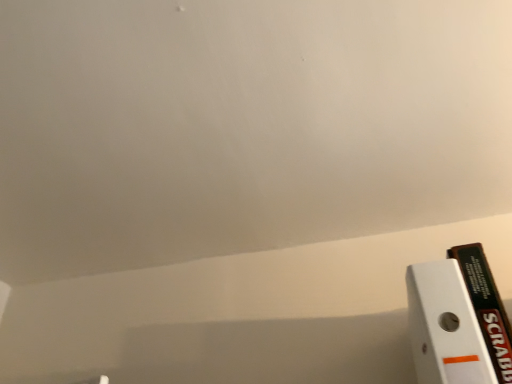
Question: From the image's perspective, is black cardboard book at right positioned above or below white matte paper at lower right?

Choices:
 (A) below
 (B) above

Answer: (A)

Question: Is black cardboard book at right wider or thinner than white matte paper at lower right?

Choices:
 (A) thin
 (B) wide

Answer: (B)

Question: Considering the positions of black cardboard book at right and white matte paper at lower right in the image, is black cardboard book at right taller or shorter than white matte paper at lower right?

Choices:
 (A) tall
 (B) short

Answer: (A)

Question: Is white matte paper at lower right bigger or smaller than black cardboard book at right?

Choices:
 (A) small
 (B) big

Answer: (A)

Question: Does point (467, 306) appear closer or farther from the camera than point (478, 246)?

Choices:
 (A) closer
 (B) farther

Answer: (A)

Question: In the image, is white matte paper at lower right positioned in front of or behind black cardboard book at right?

Choices:
 (A) front
 (B) behind

Answer: (A)

Question: From the image's perspective, is white matte paper at lower right positioned above or below black cardboard book at right?

Choices:
 (A) above
 (B) below

Answer: (A)